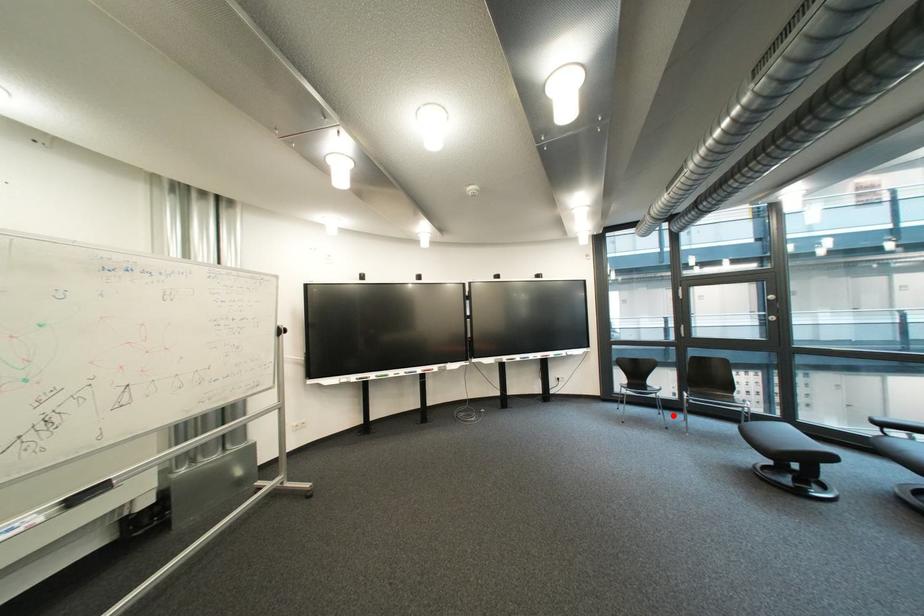
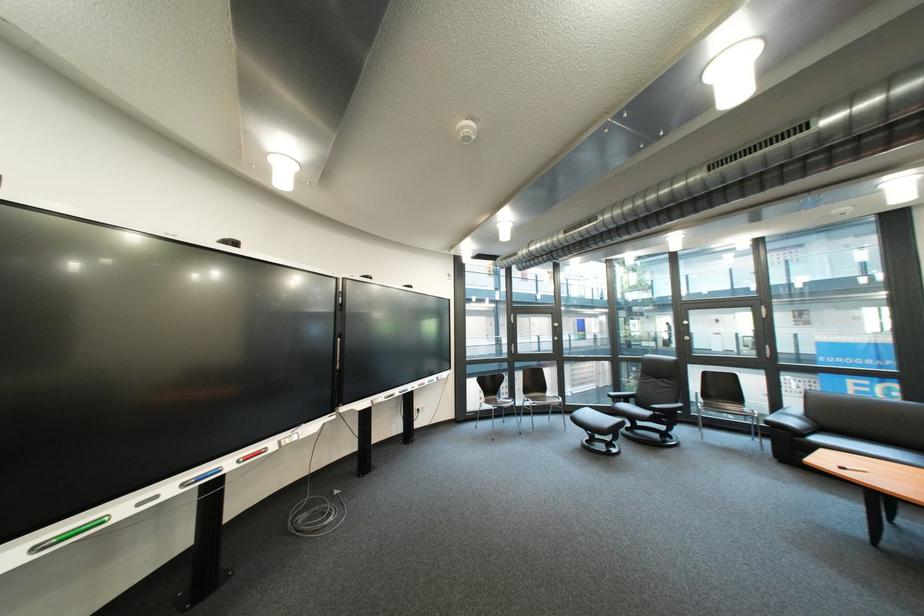
Question: I am providing you with two images of the same scene from different viewpoints. A red point is shown in image1. For the corresponding object point in image2, is it positioned nearer or farther from the camera?

Choices:
 (A) Nearer
 (B) Farther

Answer: (B)